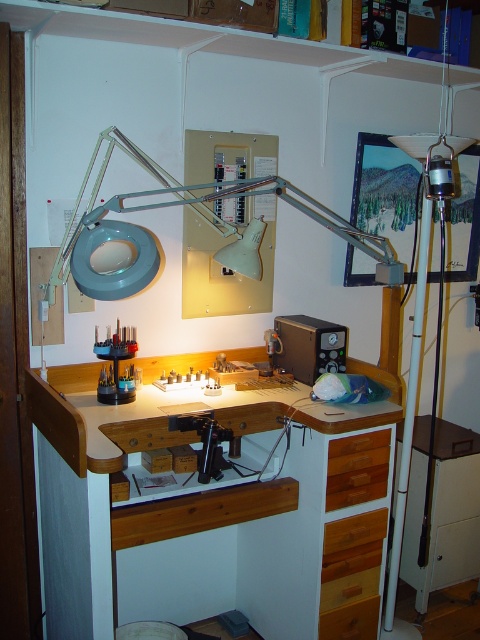
Can you confirm if wooden at center is positioned below matte plastic tool holder at center?

Correct, wooden at center is located below matte plastic tool holder at center.

Is point (166, 532) positioned after point (127, 352)?

No, (166, 532) is closer to viewer.

Where is `wooden at center`? wooden at center is located at coordinates (215, 515).

Is wooden drawer at lower right positioned in front of matte plastic tool holder at center?

Yes, wooden drawer at lower right is closer to the viewer.

Can you confirm if wooden drawer at lower right is positioned to the right of matte plastic tool holder at center?

Correct, you'll find wooden drawer at lower right to the right of matte plastic tool holder at center.

Where is `wooden drawer at lower right`? The height and width of the screenshot is (640, 480). wooden drawer at lower right is located at coordinates (351, 576).

Where is `wooden drawer at lower right`? The image size is (480, 640). wooden drawer at lower right is located at coordinates (351, 576).

In the scene shown: Measure the distance between point (111, 612) and camera.

Point (111, 612) is 5.19 feet away from camera.

Find the location of `wooden at center`. wooden at center is located at coordinates (215, 515).